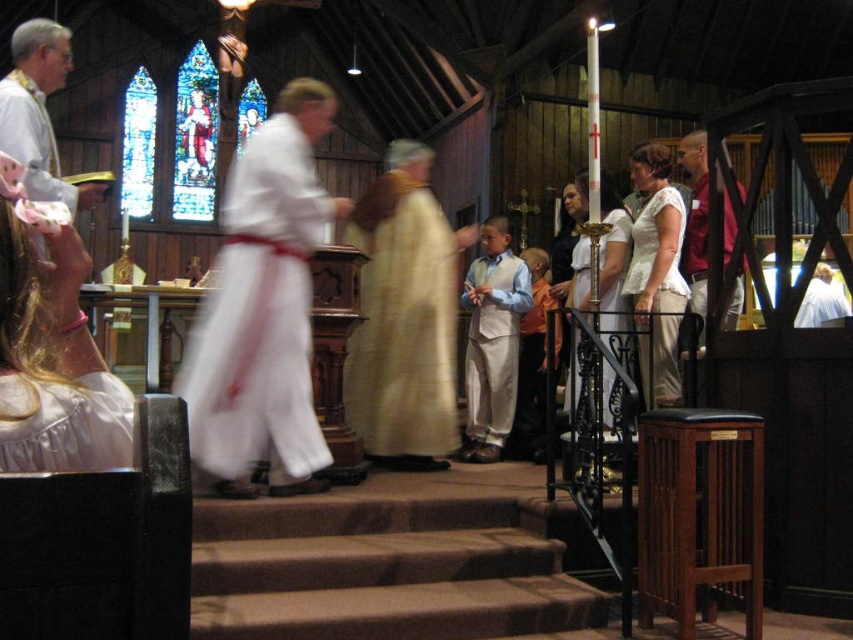
Which is below, white satin robe at lower left or matte white dress at center?

white satin robe at lower left is lower down.

Is white satin robe at lower left above matte white dress at center?

No.

The image size is (853, 640). I want to click on white satin robe at lower left, so click(x=65, y=422).

Does white satin dress at lower left have a larger size compared to light beige fabric dress at center?

Actually, white satin dress at lower left might be smaller than light beige fabric dress at center.

Which is behind, point (67, 292) or point (374, 278)?

Point (374, 278)

Describe the element at coordinates (51, 348) in the screenshot. I see `white satin dress at lower left` at that location.

Where is `white satin dress at lower left`? This screenshot has height=640, width=853. white satin dress at lower left is located at coordinates (51, 348).

Is white satin robe at lower left to the right of maroon fabric shirt at right from the viewer's perspective?

No, white satin robe at lower left is not to the right of maroon fabric shirt at right.

Can you confirm if white satin robe at lower left is thinner than maroon fabric shirt at right?

Indeed, white satin robe at lower left has a lesser width compared to maroon fabric shirt at right.

Is point (99, 419) positioned after point (724, 240)?

No, it is in front of (724, 240).

Where is `white satin robe at lower left`? white satin robe at lower left is located at coordinates (65, 422).